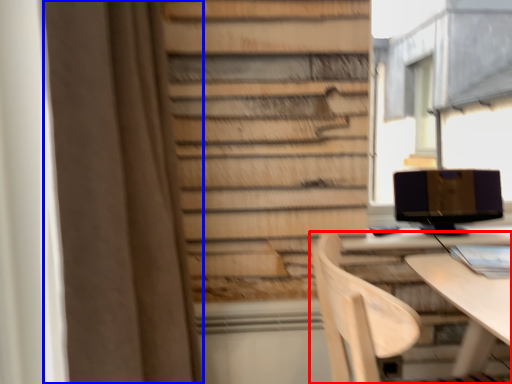
Question: Which point is closer to the camera, chair (highlighted by a red box) or curtain (highlighted by a blue box)?

Choices:
 (A) chair
 (B) curtain

Answer: (B)